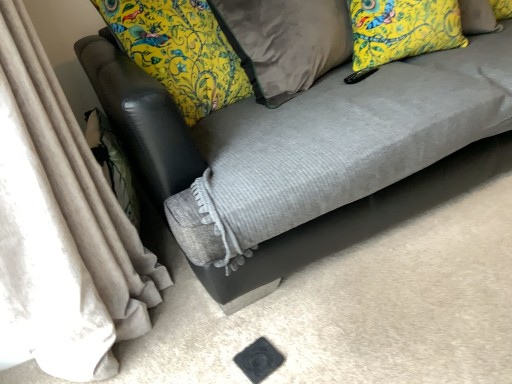
Question: From the image's perspective, is textured gray couch at center located above or below velvet brown pillow at center, marked as the 1th pillow in a left-to-right arrangement?

Choices:
 (A) above
 (B) below

Answer: (B)

Question: Looking at their shapes, would you say textured gray couch at center is wider or thinner than velvet brown pillow at center, the 2th pillow in the right-to-left sequence?

Choices:
 (A) wide
 (B) thin

Answer: (A)

Question: Estimate the real-world distances between objects in this image. Which object is farther from the velvet brown pillow at center, the 2th pillow in the right-to-left sequence?

Choices:
 (A) yellow floral fabric pillow at upper right, the 2th pillow positioned from the left
 (B) velvet gray curtain at left
 (C) textured gray couch at center

Answer: (B)

Question: Estimate the real-world distances between objects in this image. Which object is closer to the textured gray couch at center?

Choices:
 (A) velvet gray curtain at left
 (B) yellow floral fabric pillow at upper right, the 1th pillow viewed from the right
 (C) velvet brown pillow at center, marked as the 1th pillow in a left-to-right arrangement

Answer: (C)